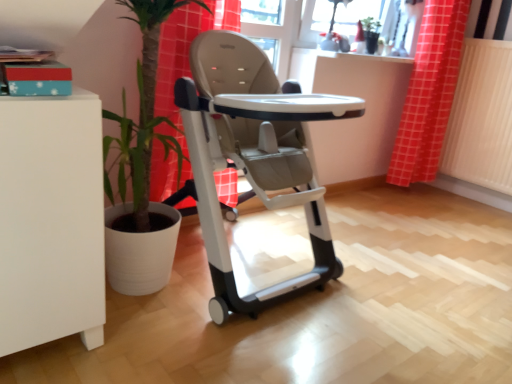
Question: Is matte gray high chair at center positioned behind matte glass window screen at upper center?

Choices:
 (A) no
 (B) yes

Answer: (A)

Question: Are matte gray high chair at center and matte glass window screen at upper center far apart?

Choices:
 (A) no
 (B) yes

Answer: (B)

Question: From a real-world perspective, is matte gray high chair at center below matte glass window screen at upper center?

Choices:
 (A) yes
 (B) no

Answer: (A)

Question: Does matte gray high chair at center have a lesser height compared to matte glass window screen at upper center?

Choices:
 (A) no
 (B) yes

Answer: (A)

Question: Considering the relative sizes of matte gray high chair at center and matte glass window screen at upper center in the image provided, is matte gray high chair at center smaller than matte glass window screen at upper center?

Choices:
 (A) yes
 (B) no

Answer: (B)

Question: Looking at their shapes, would you say matte glass window screen at upper center is wider or thinner than matte gray high chair at center?

Choices:
 (A) thin
 (B) wide

Answer: (A)

Question: Considering the relative positions of matte glass window screen at upper center and matte gray high chair at center in the image provided, is matte glass window screen at upper center to the left or to the right of matte gray high chair at center?

Choices:
 (A) right
 (B) left

Answer: (A)

Question: Considering their positions, is matte glass window screen at upper center located in front of or behind matte gray high chair at center?

Choices:
 (A) behind
 (B) front

Answer: (A)

Question: Would you say matte glass window screen at upper center is inside or outside matte gray high chair at center?

Choices:
 (A) inside
 (B) outside

Answer: (B)

Question: Visually, is red checkered curtain at upper right positioned to the left or to the right of white textured radiator at right?

Choices:
 (A) left
 (B) right

Answer: (A)

Question: Relative to white textured radiator at right, is red checkered curtain at upper right in front or behind?

Choices:
 (A) front
 (B) behind

Answer: (B)

Question: Considering the positions of red checkered curtain at upper right and white textured radiator at right in the image, is red checkered curtain at upper right taller or shorter than white textured radiator at right?

Choices:
 (A) tall
 (B) short

Answer: (A)

Question: From the image's perspective, is red checkered curtain at upper right positioned above or below white textured radiator at right?

Choices:
 (A) below
 (B) above

Answer: (B)

Question: Considering the positions of white textured radiator at right and red checkered curtain at upper right in the image, is white textured radiator at right bigger or smaller than red checkered curtain at upper right?

Choices:
 (A) small
 (B) big

Answer: (A)

Question: Is point (457, 140) positioned closer to the camera than point (421, 115)?

Choices:
 (A) farther
 (B) closer

Answer: (A)